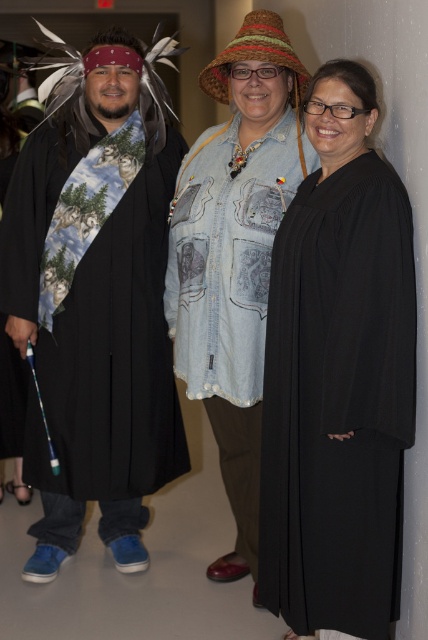
Who is more forward, (62, 358) or (228, 492)?

Point (62, 358) is in front.

Does matte black robe at left have a larger size compared to faded denim jacket at center?

Yes, matte black robe at left is bigger than faded denim jacket at center.

Is point (127, 522) closer to viewer compared to point (273, 147)?

No, it is behind (273, 147).

Where is `matte black robe at left`? This screenshot has height=640, width=428. matte black robe at left is located at coordinates (97, 298).

Who is more distant from viewer, (341, 365) or (288, 150)?

The point (288, 150) is behind.

Does black matte robe at center appear on the left side of faded denim jacket at center?

Incorrect, black matte robe at center is not on the left side of faded denim jacket at center.

Does point (302, 346) lie in front of point (261, 292)?

Yes, point (302, 346) is closer to viewer.

Where is `black matte robe at center`? black matte robe at center is located at coordinates (338, 376).

Does matte black robe at left have a larger size compared to black matte robe at center?

Correct, matte black robe at left is larger in size than black matte robe at center.

Is point (64, 419) behind point (400, 532)?

Yes.

Where is `matte black robe at left`? matte black robe at left is located at coordinates (x=97, y=298).